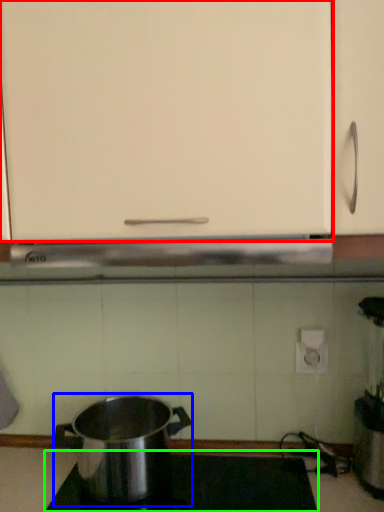
Question: Which is nearer to the cabinetry (highlighted by a red box)? kitchen appliance (highlighted by a blue box) or gas stove (highlighted by a green box).

Choices:
 (A) kitchen appliance
 (B) gas stove

Answer: (A)